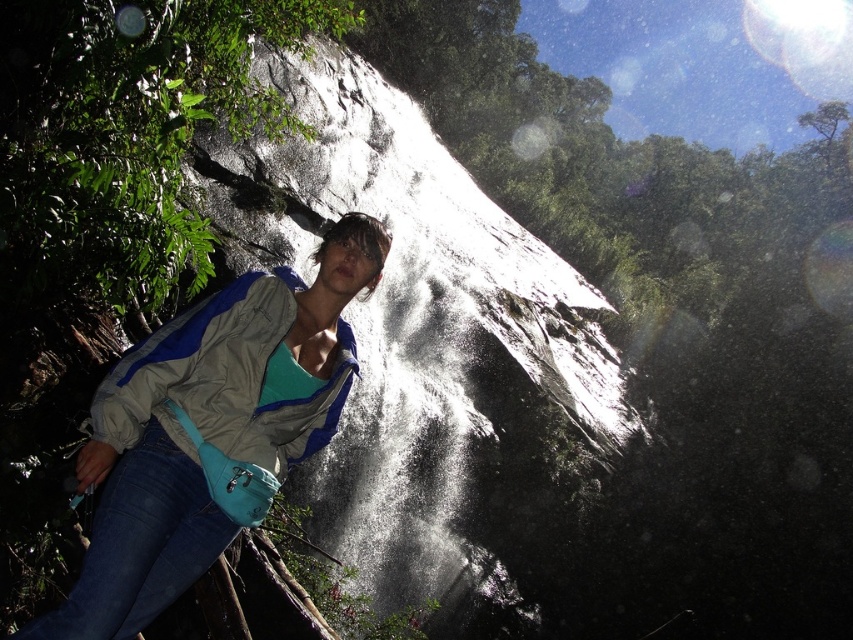
Can you confirm if gray/blue fabric jacket at center is wider than denim at left?

Yes.

In the scene shown: Is gray/blue fabric jacket at center to the right of denim at left from the viewer's perspective?

Yes, gray/blue fabric jacket at center is to the right of denim at left.

Where is `gray/blue fabric jacket at center`? The height and width of the screenshot is (640, 853). gray/blue fabric jacket at center is located at coordinates (221, 381).

Identify the location of gray/blue fabric jacket at center. The height and width of the screenshot is (640, 853). (221, 381).

Consider the image. Between matte blue jacket at center and gray/blue fabric jacket at center, which one appears on the right side from the viewer's perspective?

From the viewer's perspective, matte blue jacket at center appears more on the right side.

The width and height of the screenshot is (853, 640). What do you see at coordinates (210, 429) in the screenshot?
I see `matte blue jacket at center` at bounding box center [210, 429].

Where is `matte blue jacket at center`? This screenshot has width=853, height=640. matte blue jacket at center is located at coordinates (210, 429).

Which is behind, point (219, 490) or point (146, 573)?

The point (219, 490) is behind.

Can you confirm if matte blue jacket at center is positioned below denim at left?

Incorrect, matte blue jacket at center is not positioned below denim at left.

This screenshot has height=640, width=853. I want to click on matte blue jacket at center, so click(x=210, y=429).